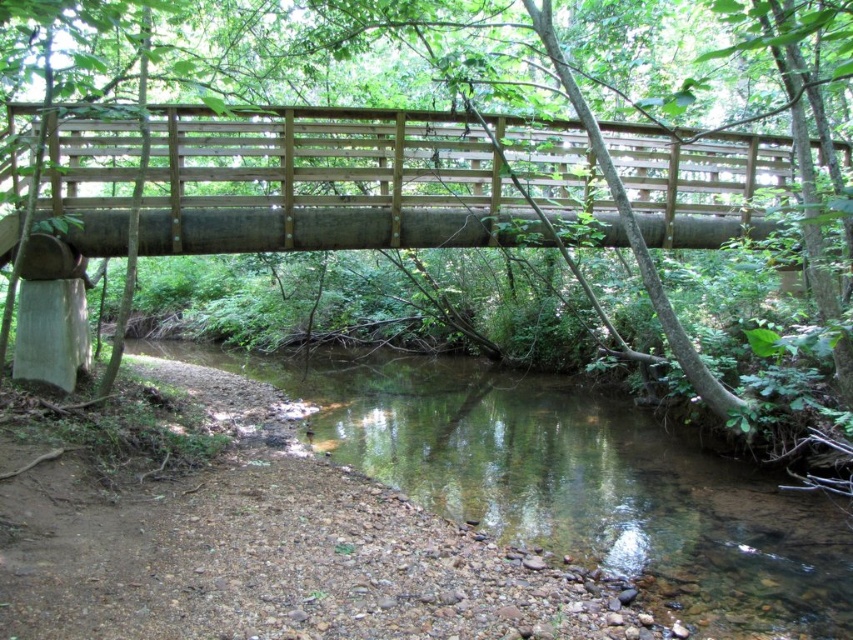
Question: Can you confirm if natural wood bridge at center is positioned below clear water at center?

Choices:
 (A) yes
 (B) no

Answer: (B)

Question: Which point is farther to the camera?

Choices:
 (A) (289, 381)
 (B) (526, 129)

Answer: (A)

Question: Which point is farther to the camera?

Choices:
 (A) natural wood bridge at center
 (B) clear water at center

Answer: (A)

Question: Can you confirm if natural wood bridge at center is positioned below clear water at center?

Choices:
 (A) yes
 (B) no

Answer: (B)

Question: Which of the following is the farthest from the observer?

Choices:
 (A) (511, 458)
 (B) (497, 196)

Answer: (A)

Question: In this image, where is natural wood bridge at center located relative to clear water at center?

Choices:
 (A) left
 (B) right

Answer: (A)